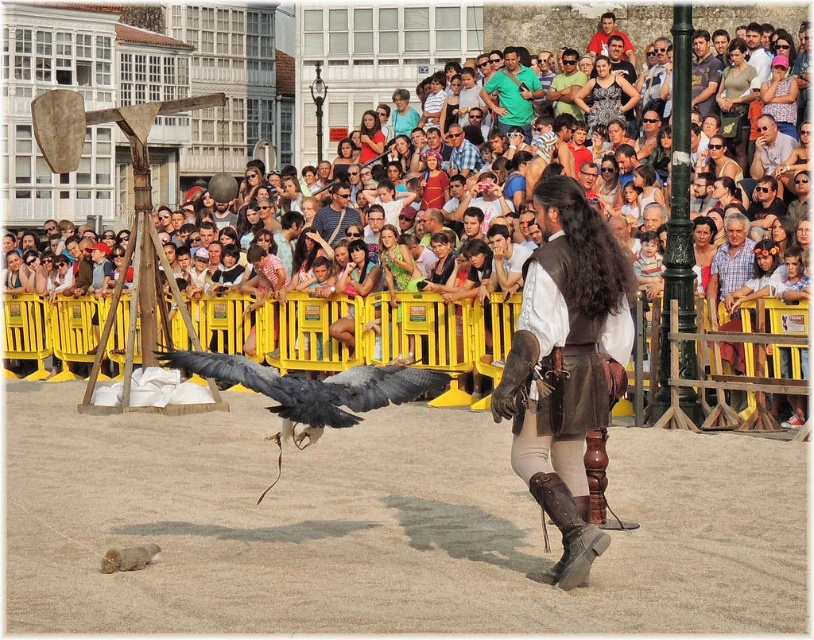
Question: Which point is closer to the camera?

Choices:
 (A) (46, 17)
 (B) (335, 232)
 (C) (629, 51)
 (D) (610, 120)

Answer: (D)

Question: Which point appears farthest from the camera in this image?

Choices:
 (A) 335,216
 (B) 174,17

Answer: (B)

Question: Does green cotton shirt at upper center appear on the right side of smooth brown leather jacket at upper center?

Choices:
 (A) yes
 (B) no

Answer: (B)

Question: Is the position of brown leather jacket at center less distant than that of blue plaid shirt at center?

Choices:
 (A) no
 (B) yes

Answer: (B)

Question: Considering the real-world distances, which object is closest to the smooth brown leather jacket at upper center?

Choices:
 (A) multicolored fabric crowd at upper center
 (B) dark gray feathers at center
 (C) matte black shirt at center
 (D) blue plaid shirt at center

Answer: (D)

Question: Does dark gray feathers at center have a larger size compared to green cotton shirt at upper center?

Choices:
 (A) no
 (B) yes

Answer: (B)